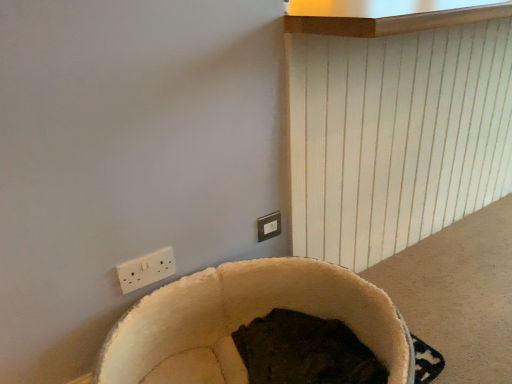
Question: From the image's perspective, is beige plush bean bag chair at lower center under white plastic power plugs and sockets at lower left?

Choices:
 (A) yes
 (B) no

Answer: (A)

Question: Does beige plush bean bag chair at lower center have a lesser height compared to white plastic power plugs and sockets at lower left?

Choices:
 (A) no
 (B) yes

Answer: (B)

Question: Is beige plush bean bag chair at lower center completely or partially outside of white plastic power plugs and sockets at lower left?

Choices:
 (A) no
 (B) yes

Answer: (B)

Question: Is beige plush bean bag chair at lower center at the right side of white plastic power plugs and sockets at lower left?

Choices:
 (A) yes
 (B) no

Answer: (A)

Question: From a real-world perspective, is beige plush bean bag chair at lower center beneath white plastic power plugs and sockets at lower left?

Choices:
 (A) yes
 (B) no

Answer: (A)

Question: From the image's perspective, is matte white switch at upper center located above or below white plastic power plugs and sockets at lower left?

Choices:
 (A) above
 (B) below

Answer: (A)

Question: Considering the positions of matte white switch at upper center and white plastic power plugs and sockets at lower left in the image, is matte white switch at upper center taller or shorter than white plastic power plugs and sockets at lower left?

Choices:
 (A) tall
 (B) short

Answer: (A)

Question: Choose the correct answer: Is matte white switch at upper center inside white plastic power plugs and sockets at lower left or outside it?

Choices:
 (A) inside
 (B) outside

Answer: (B)

Question: Looking at their shapes, would you say matte white switch at upper center is wider or thinner than white plastic power plugs and sockets at lower left?

Choices:
 (A) wide
 (B) thin

Answer: (B)

Question: From the image's perspective, relative to beige plush bean bag chair at lower center, is matte white switch at upper center above or below?

Choices:
 (A) below
 (B) above

Answer: (B)

Question: Relative to beige plush bean bag chair at lower center, is matte white switch at upper center in front or behind?

Choices:
 (A) front
 (B) behind

Answer: (B)

Question: In terms of width, does matte white switch at upper center look wider or thinner when compared to beige plush bean bag chair at lower center?

Choices:
 (A) thin
 (B) wide

Answer: (A)

Question: In terms of size, does matte white switch at upper center appear bigger or smaller than beige plush bean bag chair at lower center?

Choices:
 (A) small
 (B) big

Answer: (A)

Question: Relative to matte white switch at upper center, is beige plush bean bag chair at lower center in front or behind?

Choices:
 (A) front
 (B) behind

Answer: (A)

Question: From a real-world perspective, is beige plush bean bag chair at lower center above or below matte white switch at upper center?

Choices:
 (A) above
 (B) below

Answer: (B)